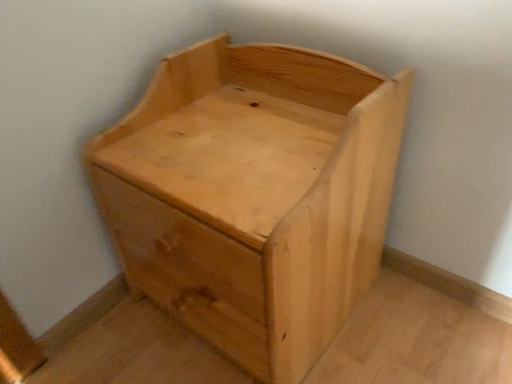
The height and width of the screenshot is (384, 512). What do you see at coordinates (254, 195) in the screenshot?
I see `natural wood toy box at center` at bounding box center [254, 195].

At what (x,y) coordinates should I click in order to perform the action: click on natural wood toy box at center. Please return your answer as a coordinate pair (x, y). The width and height of the screenshot is (512, 384). Looking at the image, I should click on (254, 195).

In order to face natural wood toy box at center, should I rotate leftwards or rightwards?

It's best to rotate left around 0.216 degrees.

Locate an element on the screen. natural wood toy box at center is located at coordinates (254, 195).